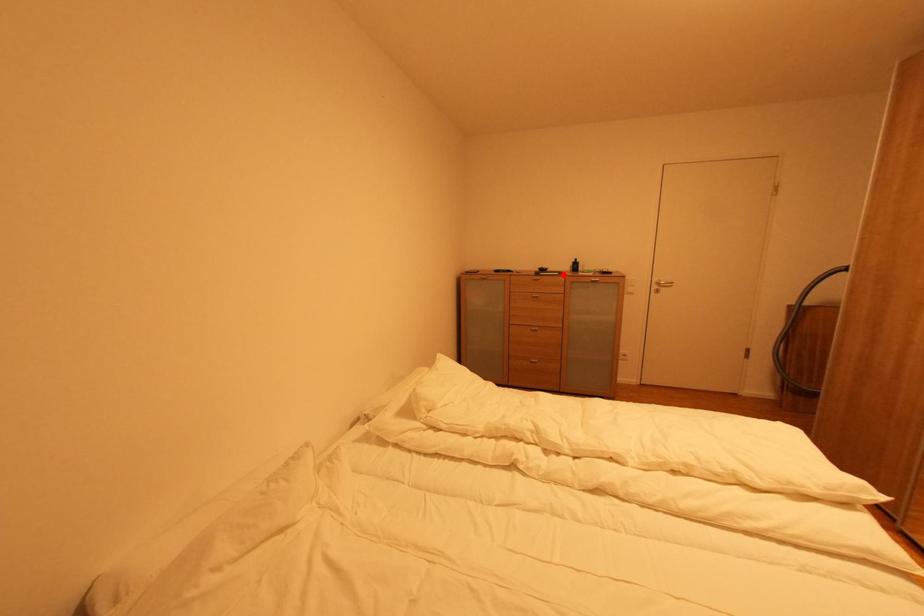
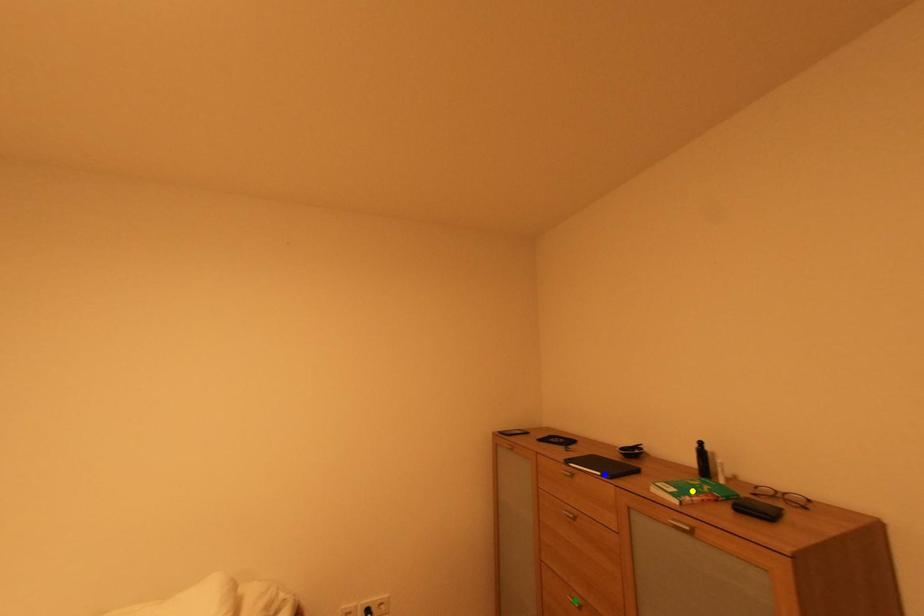
Question: I am providing you with two images of the same scene from different viewpoints. A red point is marked on the first image. You are given multiple points on the second image. In image 2, which mark is for the same physical point as the one in image 1?

Choices:
 (A) green point
 (B) yellow point
 (C) blue point

Answer: (C)